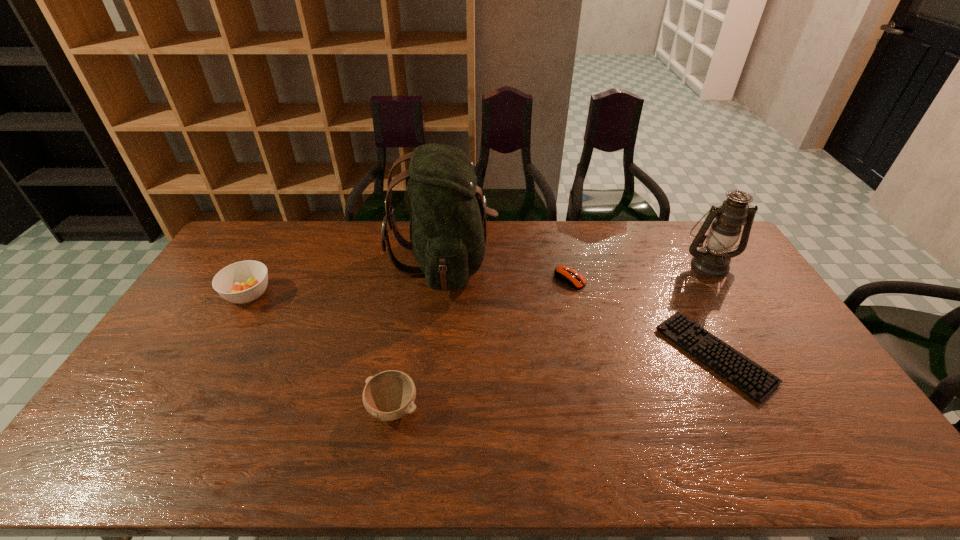
Identify the location of vacant space in between the third object from right to left and the computer keyboard. Image resolution: width=960 pixels, height=540 pixels. (642, 318).

In order to click on free space between the bowl and the shortest object in this screenshot , I will do `click(554, 382)`.

At what (x,y) coordinates should I click in order to perform the action: click on object that is the third closest one to the leftmost object. Please return your answer as a coordinate pair (x, y). This screenshot has height=540, width=960. Looking at the image, I should click on (x=565, y=274).

You are a GUI agent. You are given a task and a screenshot of the screen. Output one action in this format:
    pyautogui.click(x=<x>, y=<y>)
    Task: Click on the object that is the third closest to the computer keyboard
    This screenshot has width=960, height=540.
    Given the screenshot: What is the action you would take?
    pyautogui.click(x=448, y=230)

Locate an element on the screen. The height and width of the screenshot is (540, 960). blank space that satisfies the following two spatial constraints: 1. on the open flap of the backpack; 2. on the back side of the oil lamp is located at coordinates (444, 265).

Identify the location of vacant space that satisfies the following two spatial constraints: 1. on the back side of the second shortest object; 2. on the open flap of the tallest object. (565, 261).

Locate an element on the screen. free space in the image that satisfies the following two spatial constraints: 1. on the back side of the fifth tallest object; 2. on the left side of the bowl is located at coordinates (415, 280).

At what (x,y) coordinates should I click in order to perform the action: click on free space that satisfies the following two spatial constraints: 1. on the open flap of the tallest object; 2. on the front side of the bowl. Please return your answer as a coordinate pair (x, y). Image resolution: width=960 pixels, height=540 pixels. Looking at the image, I should click on (429, 408).

Find the location of a particular element. blank area in the image that satisfies the following two spatial constraints: 1. on the open flap of the backpack; 2. on the front side of the soup bowl is located at coordinates (441, 295).

Locate an element on the screen. This screenshot has width=960, height=540. free space that satisfies the following two spatial constraints: 1. on the back side of the second tallest object; 2. on the left side of the leftmost object is located at coordinates pyautogui.click(x=266, y=265).